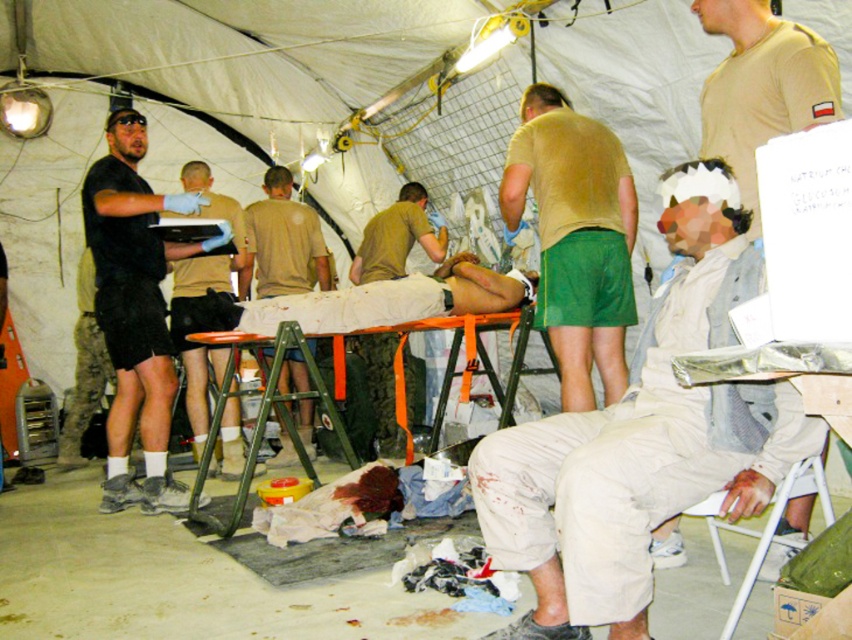
Is light brown t-shirt at center taller than black matte t-shirt at left?

No.

Does light brown t-shirt at center appear over black matte t-shirt at left?

Yes, light brown t-shirt at center is above black matte t-shirt at left.

Find the location of a particular element. This screenshot has height=640, width=852. light brown t-shirt at center is located at coordinates (576, 237).

Is point (809, 29) behind point (312, 433)?

No, it is not.

Is light brown uniform at center below tan uniform at center?

No, light brown uniform at center is not below tan uniform at center.

At what (x,y) coordinates should I click in order to perform the action: click on light brown uniform at center. Please return your answer as a coordinate pair (x, y). Looking at the image, I should click on (761, 86).

Does point (85, 196) come closer to viewer compared to point (273, 225)?

Yes.

Consider the image. Can you confirm if black matte t-shirt at left is thinner than tan uniform at center?

No, black matte t-shirt at left is not thinner than tan uniform at center.

At what (x,y) coordinates should I click in order to perform the action: click on black matte t-shirt at left. Please return your answer as a coordinate pair (x, y). Image resolution: width=852 pixels, height=640 pixels. Looking at the image, I should click on (135, 310).

In order to click on black matte t-shirt at left in this screenshot , I will do `click(135, 310)`.